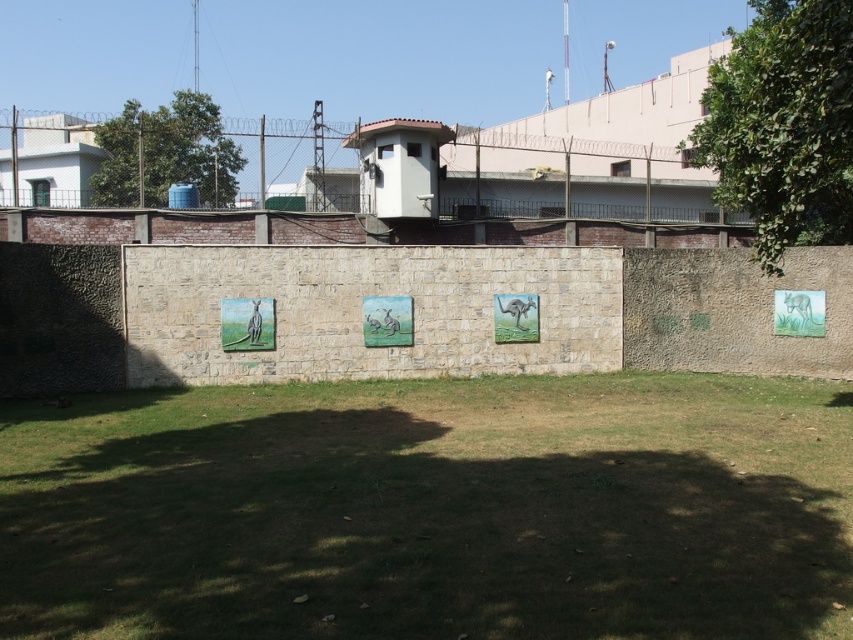
You are an architect designing a new security system for this facility. You need to install a motion sensor that must be placed at coordinates exactly 0.5 units along the x and y axes. Will the motion sensor interfere with the pastel acrylic painting of kangaroos at center?

The pastel acrylic painting of kangaroos at center is positioned at coordinates approximately (387, 321), which is very close to the desired sensor placement at (426, 320). The slight difference in coordinates means the sensor would be placed near but not directly overlapping the painting, so there should be no interference.

Consider the image. You are a security guard in the facility. You need to install a motion sensor that can cover both the green leafy tree at upper right and the pastel acrylic painting of kangaroos at center. Considering their heights, which object will require the sensor to be placed higher?

The green leafy tree at upper right is much taller than the pastel acrylic painting of kangaroos at center, so the sensor should be placed higher to cover the green leafy tree at upper right.

You are a maintenance worker needing to inspect the green leafy tree at upper right. The safety protocol requires you to stay within 20 feet of the secure facility. Can you safely approach the tree without violating the protocol?

The green leafy tree at upper right is 23.28 feet away from viewer, which exceeds the 20 feet safety protocol limit. Therefore, approaching the tree would violate the protocol.